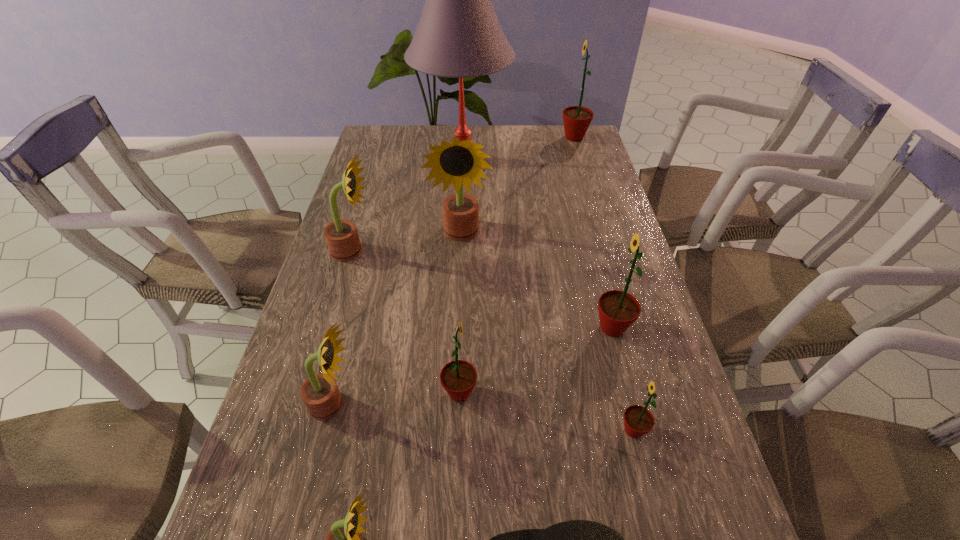
Identify the location of table lamp. (458, 35).

Where is `light table lamp`? light table lamp is located at coordinates (458, 35).

Identify the location of the farthest sunflower. (577, 119).

This screenshot has height=540, width=960. What are the coordinates of `the biggest green sunflower` in the screenshot? It's located at (577, 119).

Find the location of `the rightmost yellow sunflower`. the rightmost yellow sunflower is located at coordinates (458, 162).

The height and width of the screenshot is (540, 960). In order to click on the second biggest yellow sunflower in this screenshot , I will do `click(342, 238)`.

Locate an element on the screen. the fifth farthest object is located at coordinates (618, 310).

At what (x,y) coordinates should I click in order to perform the action: click on the third smallest green sunflower. Please return your answer as a coordinate pair (x, y). Looking at the image, I should click on (618, 310).

The height and width of the screenshot is (540, 960). I want to click on the second nearest yellow sunflower, so click(320, 394).

At what (x,y) coordinates should I click in order to perform the action: click on the second smallest green sunflower. Please return your answer as a coordinate pair (x, y). This screenshot has width=960, height=540. Looking at the image, I should click on (458, 377).